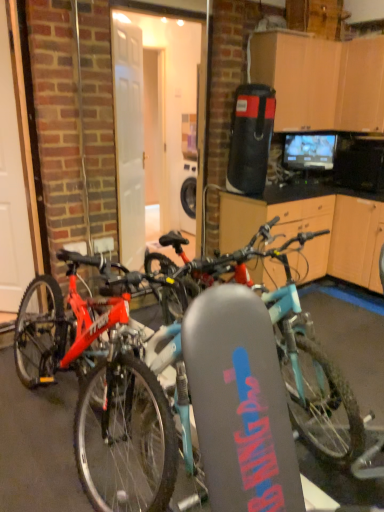
Question: From a real-world perspective, is matte red bicycle at center on white glossy door at left?

Choices:
 (A) no
 (B) yes

Answer: (A)

Question: Considering the relative positions of matte red bicycle at center and white glossy door at left in the image provided, is matte red bicycle at center to the right of white glossy door at left from the viewer's perspective?

Choices:
 (A) no
 (B) yes

Answer: (B)

Question: From the image's perspective, does matte red bicycle at center appear lower than white glossy door at left?

Choices:
 (A) yes
 (B) no

Answer: (A)

Question: Is white glossy door at left inside matte red bicycle at center?

Choices:
 (A) yes
 (B) no

Answer: (B)

Question: From the image's perspective, does matte red bicycle at center appear higher than white glossy door at left?

Choices:
 (A) no
 (B) yes

Answer: (A)

Question: Is white glossy door at left at the back of matte red bicycle at center?

Choices:
 (A) no
 (B) yes

Answer: (A)

Question: Is white glossy door at left looking in the opposite direction of matte red bicycle at center?

Choices:
 (A) no
 (B) yes

Answer: (A)

Question: Is white glossy door at left thinner than matte red bicycle at center?

Choices:
 (A) no
 (B) yes

Answer: (B)

Question: Can you confirm if white glossy door at left is shorter than matte red bicycle at center?

Choices:
 (A) yes
 (B) no

Answer: (B)

Question: From a real-world perspective, is white glossy door at left physically above matte red bicycle at center?

Choices:
 (A) no
 (B) yes

Answer: (B)

Question: Is white glossy door at left behind matte red bicycle at center?

Choices:
 (A) yes
 (B) no

Answer: (A)

Question: Could you tell me if white glossy door at left is facing matte red bicycle at center?

Choices:
 (A) no
 (B) yes

Answer: (A)

Question: Considering their positions, is matte red bicycle at center located in front of or behind white glossy door at left?

Choices:
 (A) behind
 (B) front

Answer: (B)